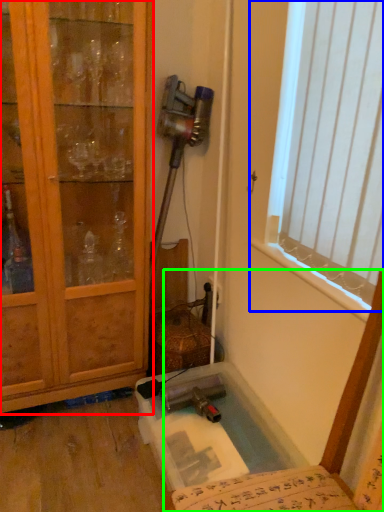
Question: Considering the real-world distances, which object is closest to cabinetry (highlighted by a red box)? window (highlighted by a blue box) or chair (highlighted by a green box).

Choices:
 (A) window
 (B) chair

Answer: (A)